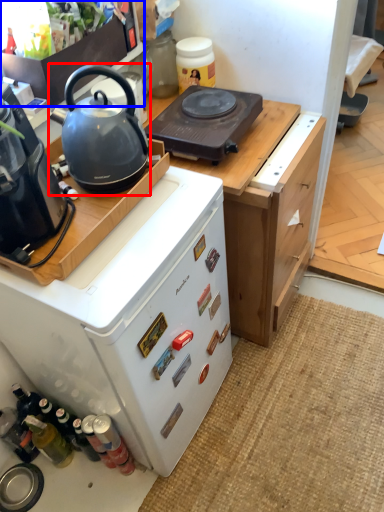
Question: Among these objects, which one is nearest to the camera, kettle (highlighted by a red box) or kitchen appliance (highlighted by a blue box)?

Choices:
 (A) kettle
 (B) kitchen appliance

Answer: (A)